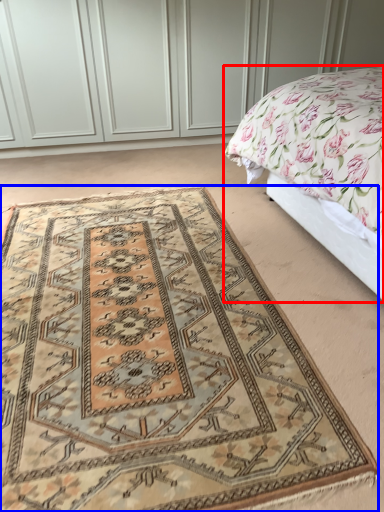
Question: Which object is further to the camera taking this photo, bed (highlighted by a red box) or mat (highlighted by a blue box)?

Choices:
 (A) bed
 (B) mat

Answer: (A)